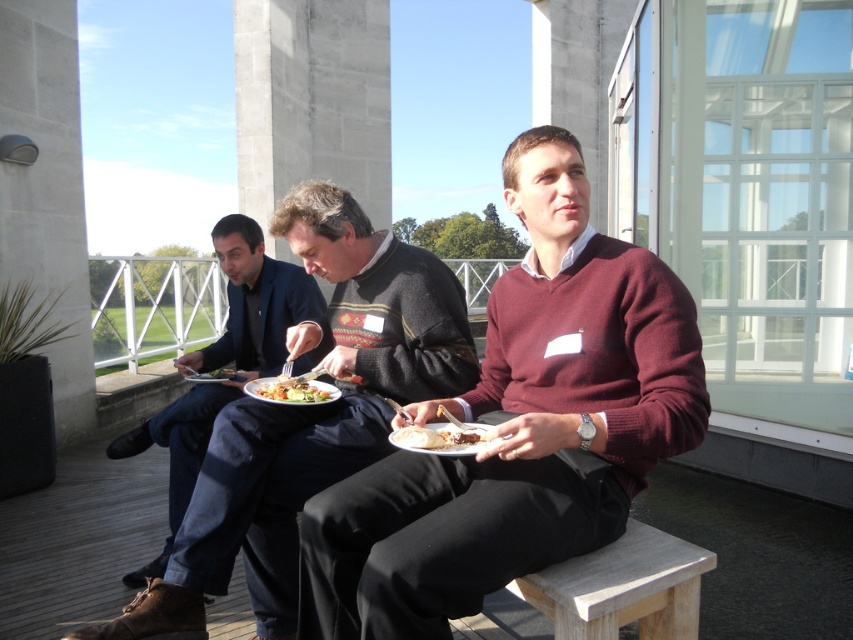
Question: Among these objects, which one is nearest to the camera?

Choices:
 (A) knitted sweater at center
 (B) white glossy plate at center
 (C) matte plastic plate at center
 (D) dark blue suit at center

Answer: (B)

Question: Which of these objects is positioned farthest from the white glossy plate at center?

Choices:
 (A) matte plastic plate at center
 (B) vibrant mixed vegetables at center
 (C) burgundy sweater at center

Answer: (B)

Question: Does burgundy sweater at center have a smaller size compared to matte plastic plate at center?

Choices:
 (A) yes
 (B) no

Answer: (B)

Question: Estimate the real-world distances between objects in this image. Which object is closer to the burgundy sweater at center?

Choices:
 (A) knitted sweater at center
 (B) matte plastic plate at center
 (C) vibrant mixed vegetables at center

Answer: (A)

Question: Is white glossy plate at center in front of matte plastic plate at center?

Choices:
 (A) no
 (B) yes

Answer: (B)

Question: Can you confirm if knitted sweater at center is bigger than matte plastic plate at center?

Choices:
 (A) yes
 (B) no

Answer: (A)